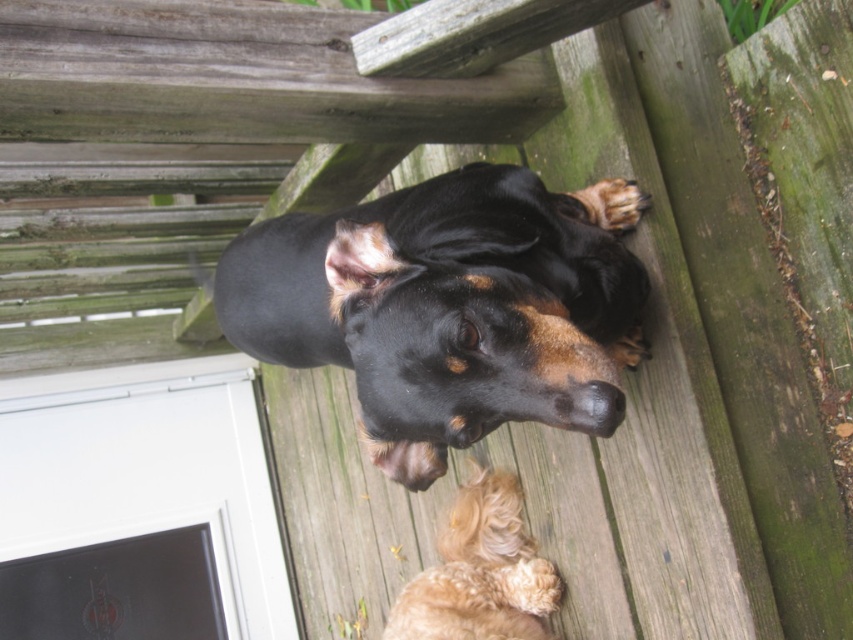
You are standing on the wooden deck and see the black shiny dog at upper center and the golden fur dog at lower center. Which dog is closer to the left edge of the deck?

The black shiny dog at upper center is positioned on the left side of golden fur dog at lower center, so it is closer to the left edge of the deck.

You are standing on the wooden deck and want to place a small bowl of water for both dogs. Based on their positions, where should you place the bowl so that both the black shiny dog at upper center and the golden fur dog at lower center can easily reach it?

The bowl should be placed between the black shiny dog at upper center and the golden fur dog at lower center since the black shiny dog is above the golden fur dog, making the middle area accessible to both.